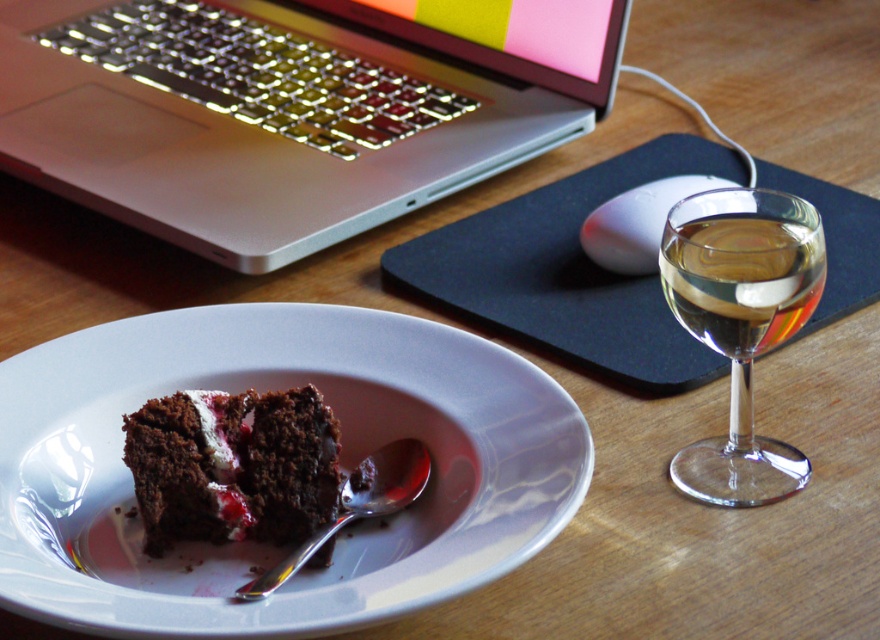
Question: Which object is positioned closest to the chocolatemoistcake at center-left?

Choices:
 (A) clear glass wine at right
 (B) transparent glass wine glass at right
 (C) silver metallic spoon at plate center
 (D) silver metallic laptop at upper left

Answer: (C)

Question: Is silver metallic spoon at plate center wider than white matte mouse at center?

Choices:
 (A) no
 (B) yes

Answer: (A)

Question: Among these points, which one is farthest from the camera?

Choices:
 (A) (185, 433)
 (B) (222, 90)
 (C) (422, 500)
 (D) (350, 516)

Answer: (B)

Question: Based on their relative distances, which object is nearer to the white glossy plate at center?

Choices:
 (A) transparent glass wine glass at right
 (B) chocolatemoistcake at center-left
 (C) white matte mouse at center
 (D) clear glass wine at right

Answer: (B)

Question: Does chocolatemoistcake at center-left appear over white matte mouse at center?

Choices:
 (A) no
 (B) yes

Answer: (A)

Question: Observing the image, what is the correct spatial positioning of chocolatemoistcake at center-left in reference to white matte mouse at center?

Choices:
 (A) below
 (B) above

Answer: (A)